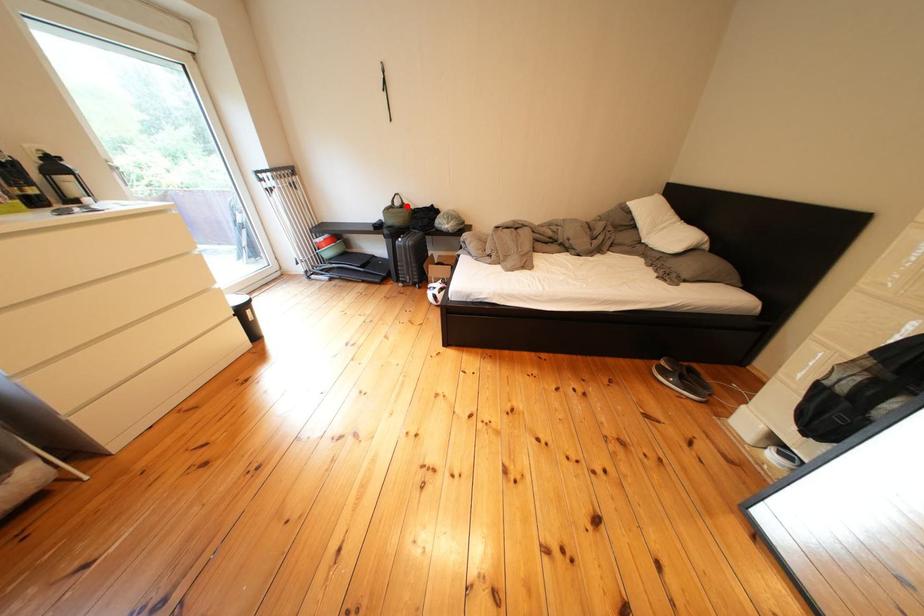
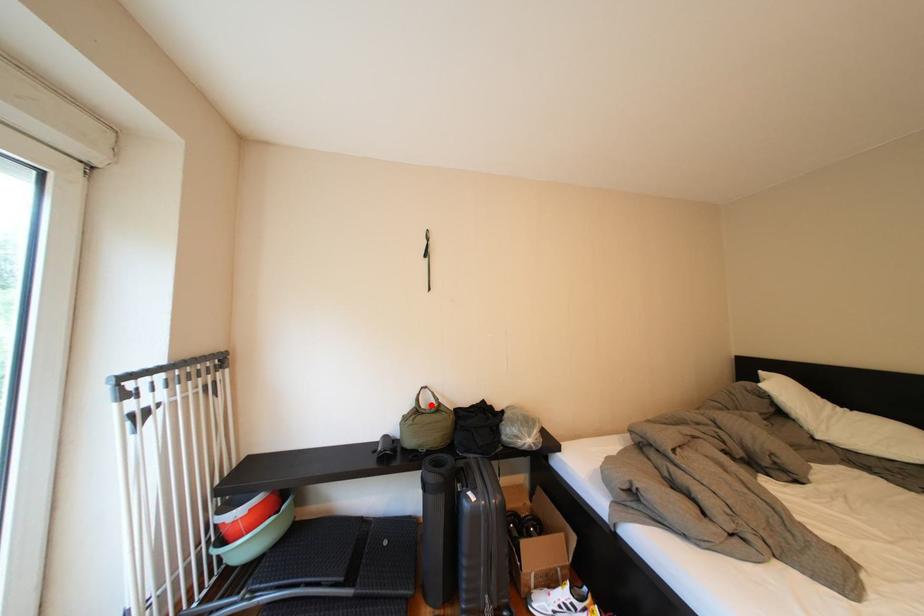
I am providing you with two images of the same scene from different viewpoints. A red point is marked on the first image and another point is marked on the second image. Is the red point in image1 aligned with the point shown in image2?

Yes